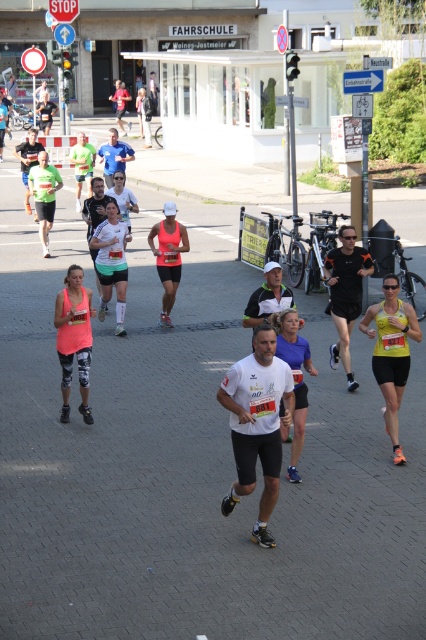
Question: Among these objects, which one is farthest from the camera?

Choices:
 (A) pink matte tank top at center
 (B) matte black leggings at center
 (C) white matte running outfit at center

Answer: (A)

Question: Is white matte running outfit at center bigger than pink matte tank top at center?

Choices:
 (A) no
 (B) yes

Answer: (A)

Question: Which object appears farthest from the camera in this image?

Choices:
 (A) matte blue shorts at center
 (B) yellow fabric runner at center

Answer: (B)

Question: Is matte black leggings at center bigger than white matte running outfit at center?

Choices:
 (A) no
 (B) yes

Answer: (A)

Question: Is white matte running outfit at center bigger than pink matte tank top at center?

Choices:
 (A) no
 (B) yes

Answer: (A)

Question: Which of the following is the closest to the observer?

Choices:
 (A) yellow fabric runner at center
 (B) pink matte tank top at center
 (C) matte blue shorts at center

Answer: (C)